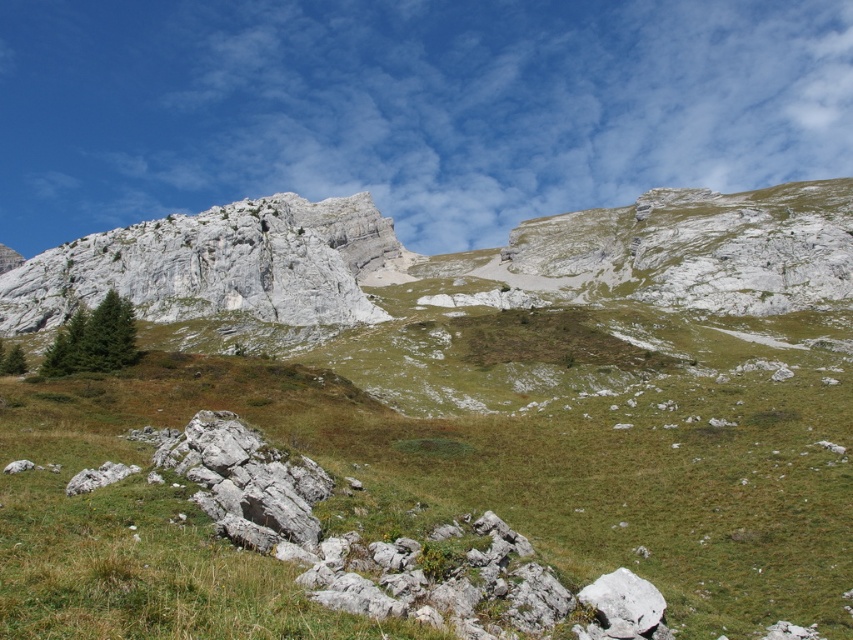
Question: Does green grassy at center have a smaller size compared to gray rock formation at upper left?

Choices:
 (A) no
 (B) yes

Answer: (B)

Question: Among these points, which one is nearest to the camera?

Choices:
 (A) (827, 397)
 (B) (93, 241)

Answer: (A)

Question: Does green grassy at center have a greater width compared to gray rock formation at upper left?

Choices:
 (A) no
 (B) yes

Answer: (A)

Question: Which object appears closest to the camera in this image?

Choices:
 (A) green grassy at center
 (B) gray rock formation at upper left

Answer: (A)

Question: In this image, where is green grassy at center located relative to gray rock formation at upper left?

Choices:
 (A) below
 (B) above

Answer: (A)